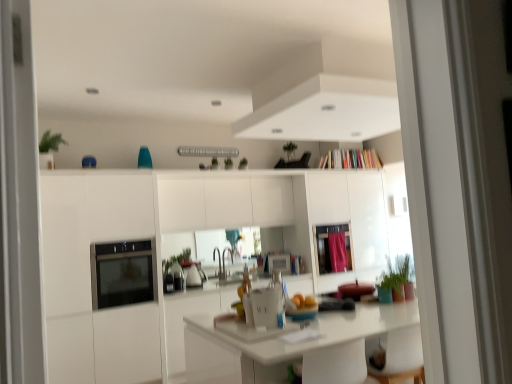
Question: Does pink fabric curtain at upper center have a smaller size compared to green matte plant at upper center, placed as the second plant when sorted from top to bottom?

Choices:
 (A) yes
 (B) no

Answer: (B)

Question: Does pink fabric curtain at upper center have a greater height compared to green matte plant at upper center, placed as the second plant when sorted from top to bottom?

Choices:
 (A) no
 (B) yes

Answer: (B)

Question: Is pink fabric curtain at upper center further to camera compared to green matte plant at upper center, arranged as the second plant when viewed from the front?

Choices:
 (A) no
 (B) yes

Answer: (B)

Question: From a real-world perspective, is pink fabric curtain at upper center positioned over green matte plant at upper center, which is counted as the 2th plant, starting from the bottom, based on gravity?

Choices:
 (A) no
 (B) yes

Answer: (A)

Question: Is green matte plant at upper center, which ranks as the 3th plant in right-to-left order, inside pink fabric curtain at upper center?

Choices:
 (A) yes
 (B) no

Answer: (B)

Question: Does point (293, 157) appear closer or farther from the camera than point (334, 266)?

Choices:
 (A) closer
 (B) farther

Answer: (A)

Question: Considering the positions of green matte plant at upper center, which ranks as the 3th plant in bottom-to-top order, and pink fabric curtain at upper center in the image, is green matte plant at upper center, which ranks as the 3th plant in bottom-to-top order, taller or shorter than pink fabric curtain at upper center?

Choices:
 (A) short
 (B) tall

Answer: (A)

Question: Is green matte plant at upper center, the 1th plant from the top, inside the boundaries of pink fabric curtain at upper center, or outside?

Choices:
 (A) inside
 (B) outside

Answer: (B)

Question: Looking at the image, does green matte plant at upper center, the 1th plant from the top, seem bigger or smaller compared to pink fabric curtain at upper center?

Choices:
 (A) small
 (B) big

Answer: (A)

Question: From a real-world perspective, relative to green matte plant at upper center, the 1th plant positioned from the back, is green matte plant at lower right, placed as the 1th plant when sorted from right to left, vertically above or below?

Choices:
 (A) below
 (B) above

Answer: (A)

Question: Would you say green matte plant at lower right, which ranks as the 3th plant in left-to-right order, is to the left or to the right of green matte plant at upper center, the 1th plant positioned from the back, in the picture?

Choices:
 (A) left
 (B) right

Answer: (B)

Question: From the image's perspective, is green matte plant at lower right, marked as the 1th plant in a bottom-to-top arrangement, positioned above or below green matte plant at upper center, the second plant positioned from the left?

Choices:
 (A) below
 (B) above

Answer: (A)

Question: Considering the positions of green matte plant at lower right, arranged as the 3th plant when viewed from the back, and green matte plant at upper center, the 1th plant positioned from the back, in the image, is green matte plant at lower right, arranged as the 3th plant when viewed from the back, bigger or smaller than green matte plant at upper center, the 1th plant positioned from the back,?

Choices:
 (A) big
 (B) small

Answer: (A)

Question: Is pink fabric curtain at upper center situated inside green matte plant at lower right, placed as the 1th plant when sorted from front to back, or outside?

Choices:
 (A) outside
 (B) inside

Answer: (A)

Question: Considering the positions of pink fabric curtain at upper center and green matte plant at lower right, which is the third plant in top-to-bottom order, in the image, is pink fabric curtain at upper center bigger or smaller than green matte plant at lower right, which is the third plant in top-to-bottom order,?

Choices:
 (A) small
 (B) big

Answer: (A)